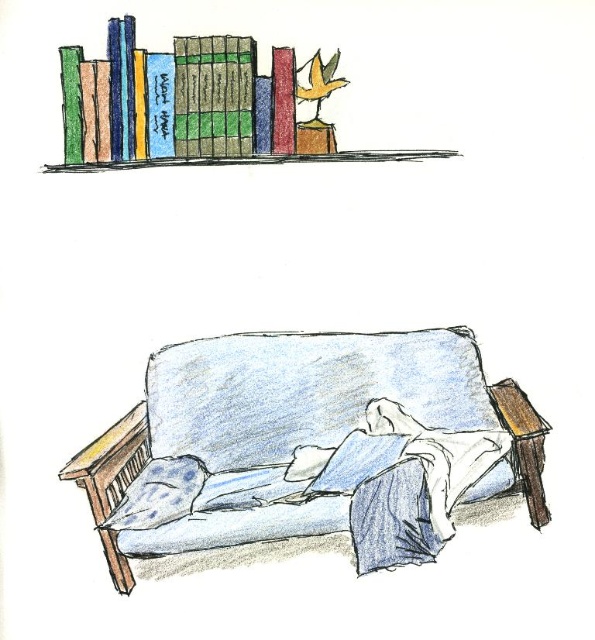
Can you confirm if blue fabric couch at center is shorter than matte green book at upper left?

Incorrect, blue fabric couch at center's height does not fall short of matte green book at upper left's.

Which is more to the left, blue fabric couch at center or matte green book at upper left?

matte green book at upper left is more to the left.

This screenshot has height=640, width=595. What do you see at coordinates (309, 445) in the screenshot? I see `blue fabric couch at center` at bounding box center [309, 445].

What are the coordinates of `blue fabric couch at center` in the screenshot? It's located at (309, 445).

Can you confirm if blue dotted pillow at lower left is bigger than orange matte bird at upper center?

Yes, blue dotted pillow at lower left is bigger than orange matte bird at upper center.

Is blue dotted pillow at lower left smaller than orange matte bird at upper center?

No.

Is point (152, 467) positioned in front of point (308, 88)?

Yes, it is.

Where is `blue dotted pillow at lower left`? blue dotted pillow at lower left is located at coordinates coord(158,493).

Is matte green book at upper left taller than blue dotted pillow at lower left?

Result: Correct, matte green book at upper left is much taller as blue dotted pillow at lower left.

The width and height of the screenshot is (595, 640). Describe the element at coordinates (165, 100) in the screenshot. I see `matte green book at upper left` at that location.

This screenshot has height=640, width=595. Find the location of `matte green book at upper left`. matte green book at upper left is located at coordinates (165, 100).